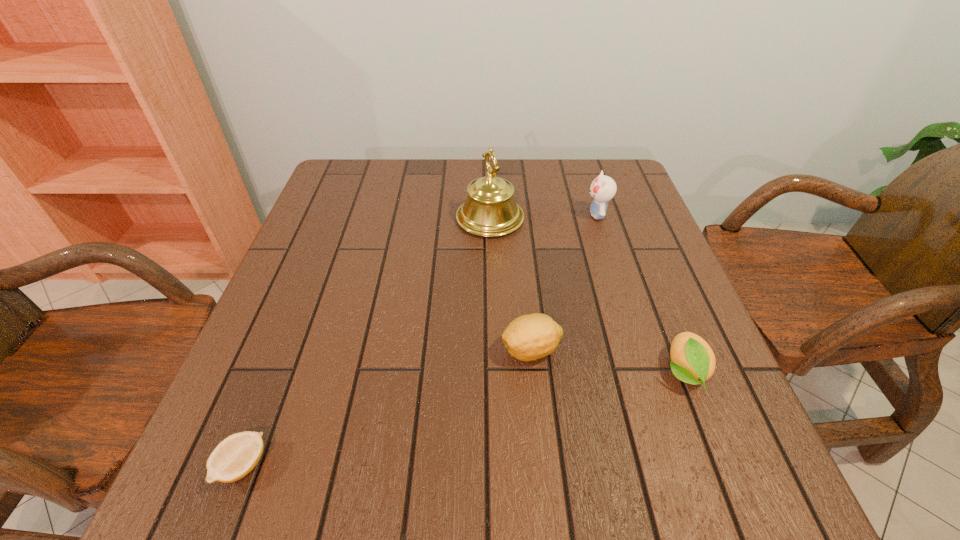
What are the coordinates of `vacant point located between the bell and the second lemon from left to right` in the screenshot? It's located at (511, 284).

Locate an element on the screen. free spot between the fourth shortest object and the leftmost lemon is located at coordinates (420, 340).

Identify the location of unoccupied area between the rightmost lemon and the leftmost object. This screenshot has width=960, height=540. (464, 418).

The height and width of the screenshot is (540, 960). I want to click on free space between the rightmost lemon and the shortest lemon, so click(x=464, y=418).

You are a GUI agent. You are given a task and a screenshot of the screen. Output one action in this format:
    pyautogui.click(x=<x>, y=<y>)
    Task: Click on the vacant point located between the shortest object and the tallest object
    This screenshot has height=540, width=960.
    Given the screenshot: What is the action you would take?
    pyautogui.click(x=367, y=342)

I want to click on object that stands as the fourth closest to the second tallest object, so click(236, 456).

Identify the location of object that can be found as the third closest to the second lemon from right to left. (603, 188).

Identify which lemon is the closest to the nearest object. Please provide its 2D coordinates. Your answer should be formatted as a tuple, i.e. [(x, y)], where the tuple contains the x and y coordinates of a point satisfying the conditions above.

[(529, 337)]

Identify which lemon is the second nearest to the second lemon from left to right. Please provide its 2D coordinates. Your answer should be formatted as a tuple, i.e. [(x, y)], where the tuple contains the x and y coordinates of a point satisfying the conditions above.

[(236, 456)]